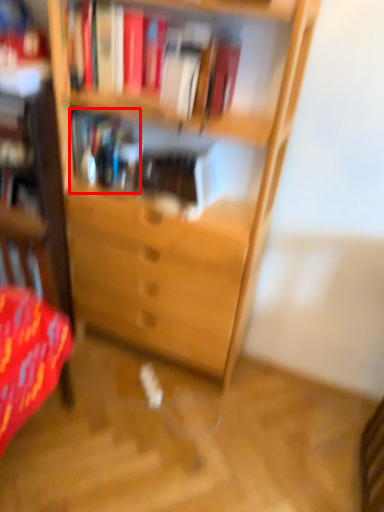
Question: From the image's perspective, what is the correct spatial positioning of book (annotated by the red box) in reference to book?

Choices:
 (A) above
 (B) below

Answer: (B)